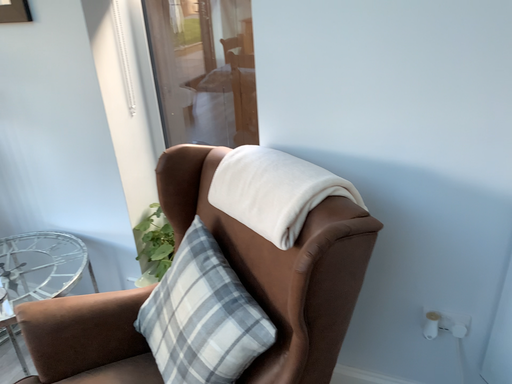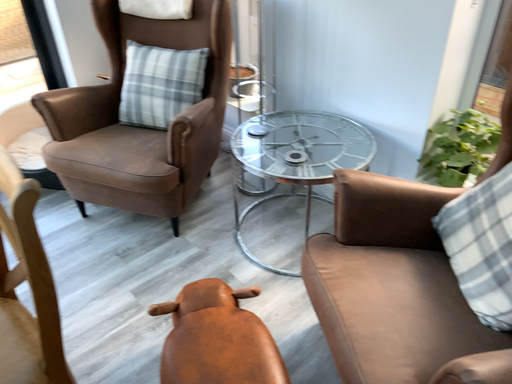
Question: How did the camera likely rotate when shooting the video?

Choices:
 (A) rotated downward
 (B) rotated upward

Answer: (A)